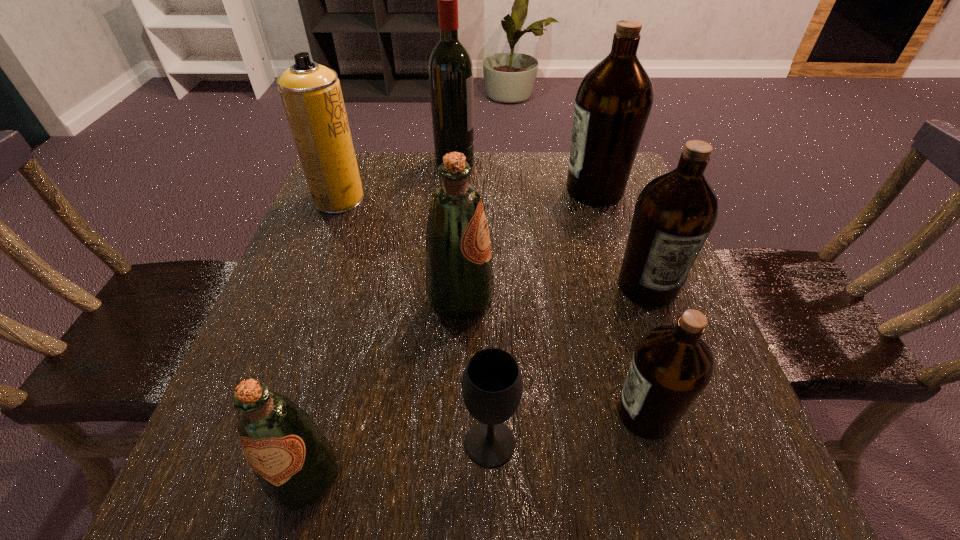
Locate an element on the screen. The image size is (960, 540). the shortest object is located at coordinates (492, 385).

The width and height of the screenshot is (960, 540). Find the location of `vacant space situated on the label of the red wine bottle`. vacant space situated on the label of the red wine bottle is located at coordinates (589, 163).

Where is `blank space located on the label of the farthest olive oil`? blank space located on the label of the farthest olive oil is located at coordinates pyautogui.click(x=401, y=190).

Locate an element on the screen. This screenshot has height=540, width=960. free location located 0.390m on the label of the farthest olive oil is located at coordinates (405, 190).

At what (x,y) coordinates should I click in order to perform the action: click on vacant space located 0.240m on the label of the farthest olive oil. Please return your answer as a coordinate pair (x, y). Looking at the image, I should click on (466, 190).

I want to click on vacant space situated 0.110m on the front of the aerosol can, so click(322, 245).

Where is `vacant space located 0.130m on the front-facing side of the bigger green olive oil`? vacant space located 0.130m on the front-facing side of the bigger green olive oil is located at coordinates (563, 299).

Image resolution: width=960 pixels, height=540 pixels. Identify the location of vacant space located on the label of the second farthest brown olive oil. (703, 436).

This screenshot has width=960, height=540. Identify the location of free region located on the label of the smallest brown olive oil. (383, 414).

Identify the location of vacant space located on the label of the smallest brown olive oil. click(x=350, y=414).